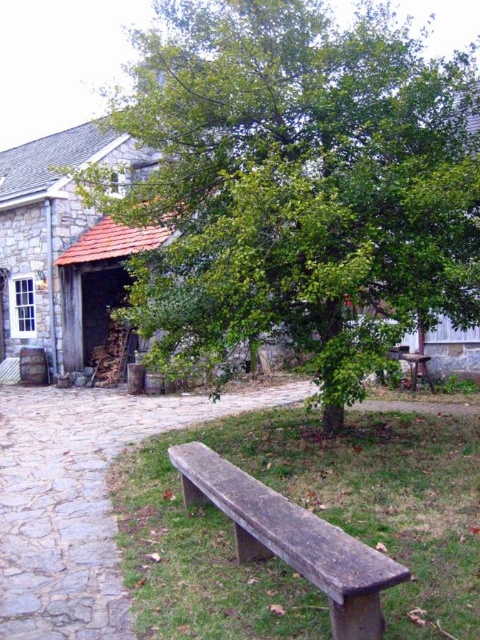
Question: Among these objects, which one is nearest to the camera?

Choices:
 (A) weathered wood bench at lower center
 (B) wooden bench at center

Answer: (A)

Question: Estimate the real-world distances between objects in this image. Which object is closer to the brown stone bench at center?

Choices:
 (A) green leafy tree at center
 (B) wooden bench at center
 (C) weathered wood bench at lower center

Answer: (C)

Question: Which of the following is the closest to the observer?

Choices:
 (A) (407, 355)
 (B) (297, 76)
 (C) (219, 488)

Answer: (C)

Question: Does green leafy tree at center have a greater width compared to wooden bench at center?

Choices:
 (A) yes
 (B) no

Answer: (A)

Question: Can you confirm if green leafy tree at center is bigger than weathered wood bench at lower center?

Choices:
 (A) yes
 (B) no

Answer: (A)

Question: Is green leafy tree at center positioned at the back of wooden bench at center?

Choices:
 (A) no
 (B) yes

Answer: (A)